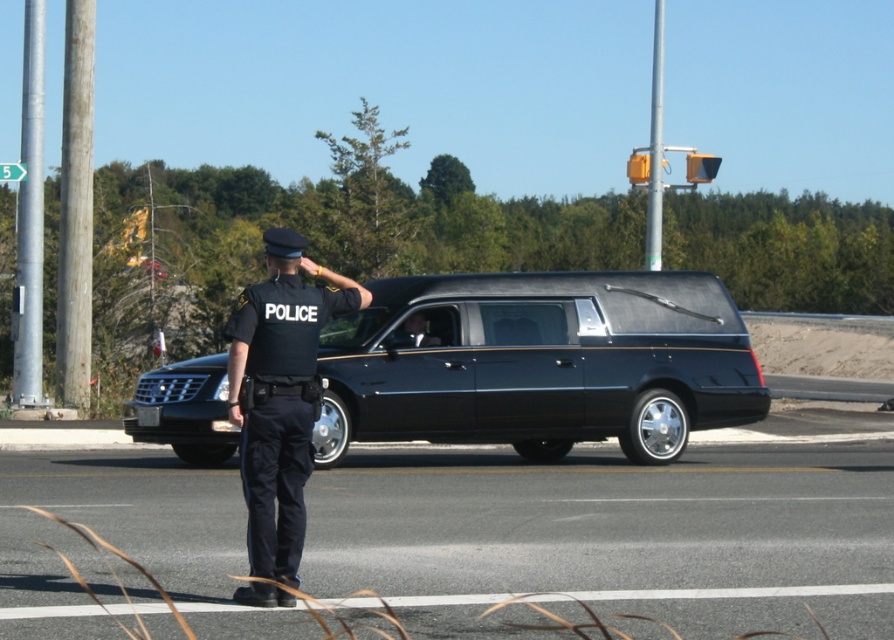
Question: Which point is closer to the camera?

Choices:
 (A) black uniform at center
 (B) black glossy hearse at center

Answer: (A)

Question: Among these objects, which one is farthest from the camera?

Choices:
 (A) black glossy hearse at center
 (B) black uniform at center

Answer: (A)

Question: Is black glossy hearse at center to the right of black uniform at center from the viewer's perspective?

Choices:
 (A) no
 (B) yes

Answer: (B)

Question: Does black glossy hearse at center appear over black uniform at center?

Choices:
 (A) no
 (B) yes

Answer: (A)

Question: Does black glossy hearse at center have a larger size compared to black uniform at center?

Choices:
 (A) no
 (B) yes

Answer: (B)